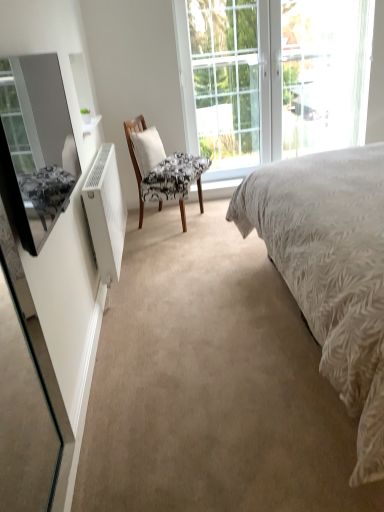
You are a GUI agent. You are given a task and a screenshot of the screen. Output one action in this format:
    pyautogui.click(x=<x>, y=<y>)
    Task: Click on the free space to the right of white matte radiator at left
    Image resolution: width=384 pixels, height=512 pixels.
    Given the screenshot: What is the action you would take?
    pyautogui.click(x=178, y=254)